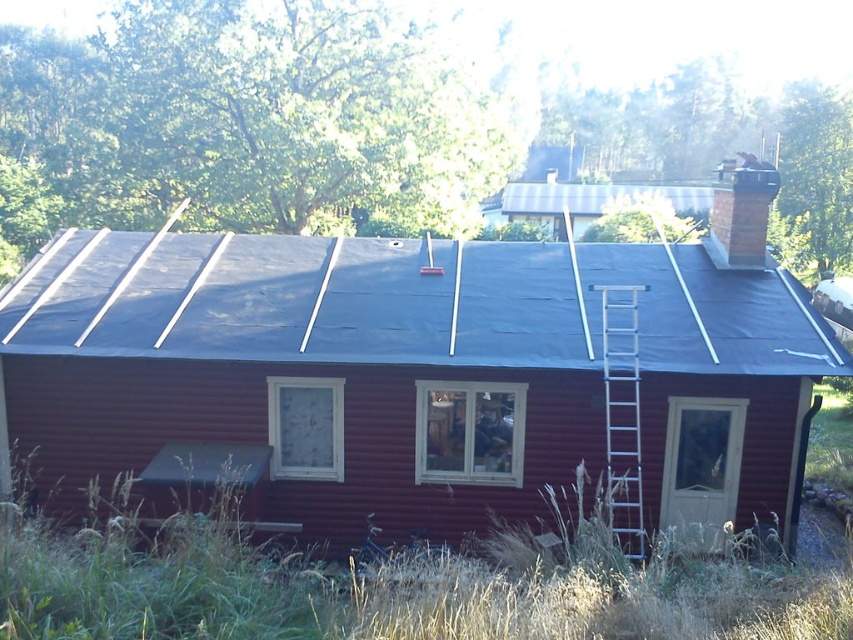
Question: Is smooth dark blue tarp at center below silver metallic ladder at right?

Choices:
 (A) yes
 (B) no

Answer: (B)

Question: Estimate the real-world distances between objects in this image. Which object is farther from the silver metallic ladder at right?

Choices:
 (A) smooth dark blue tarp at center
 (B) black tarp at center

Answer: (B)

Question: Which object is the closest to the silver metallic ladder at right?

Choices:
 (A) black tarp at center
 (B) smooth dark blue tarp at center

Answer: (B)

Question: Where is smooth dark blue tarp at center located in relation to silver metallic ladder at right in the image?

Choices:
 (A) above
 (B) below

Answer: (A)

Question: In this image, where is smooth dark blue tarp at center located relative to silver metallic ladder at right?

Choices:
 (A) left
 (B) right

Answer: (B)

Question: Which point is farther to the camera?

Choices:
 (A) (263, 372)
 (B) (619, 532)
 (C) (248, 243)

Answer: (C)